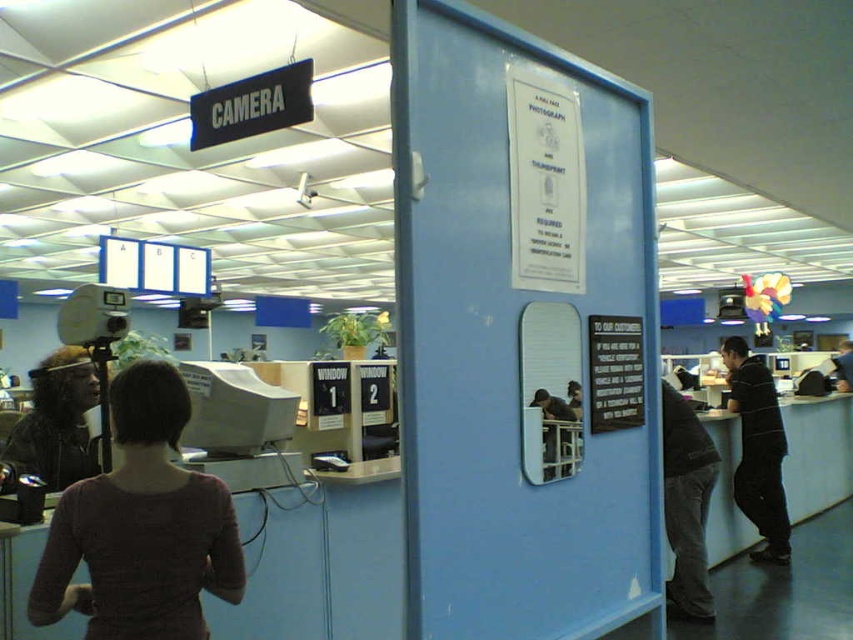
Is point (171, 536) positioned in front of point (756, 384)?

Yes.

Which is more to the right, dark purple sweater at center or black striped shirt at right?

black striped shirt at right

Locate an element on the screen. dark purple sweater at center is located at coordinates (141, 525).